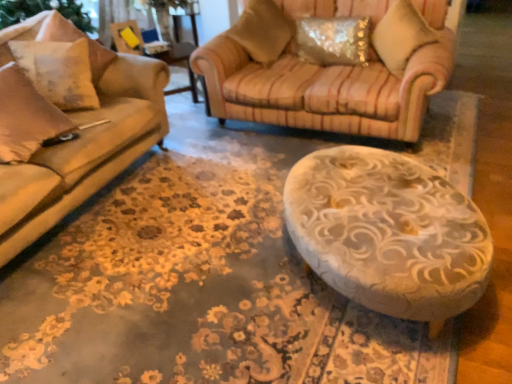
Question: In terms of width, does sparkly metallic pillow at upper right, the 3th pillow in the left-to-right sequence, look wider or thinner when compared to white textured pillow at left, arranged as the 1th pillow when viewed from the left?

Choices:
 (A) thin
 (B) wide

Answer: (A)

Question: Based on their sizes in the image, would you say sparkly metallic pillow at upper right, the 3th pillow in the left-to-right sequence, is bigger or smaller than white textured pillow at left, which is the 4th pillow in right-to-left order?

Choices:
 (A) big
 (B) small

Answer: (B)

Question: Based on their relative distances, which object is nearer to the textured beige pillow at upper center, acting as the third pillow starting from the right?

Choices:
 (A) white textured pillow at left, arranged as the 1th pillow when viewed from the left
 (B) sparkly metallic pillow at upper right, which is counted as the second pillow, starting from the right
 (C) velvet striped pillow at upper right, which appears as the first pillow when viewed from the right
 (D) yellow plastic swivel chair at upper left

Answer: (B)

Question: Which object is positioned closest to the yellow plastic swivel chair at upper left?

Choices:
 (A) velvet striped pillow at upper right, which is the 4th pillow in left-to-right order
 (B) white textured pillow at left, which is the 4th pillow in right-to-left order
 (C) sparkly metallic pillow at upper right, the 3th pillow in the left-to-right sequence
 (D) textured beige pillow at upper center, acting as the third pillow starting from the right

Answer: (B)